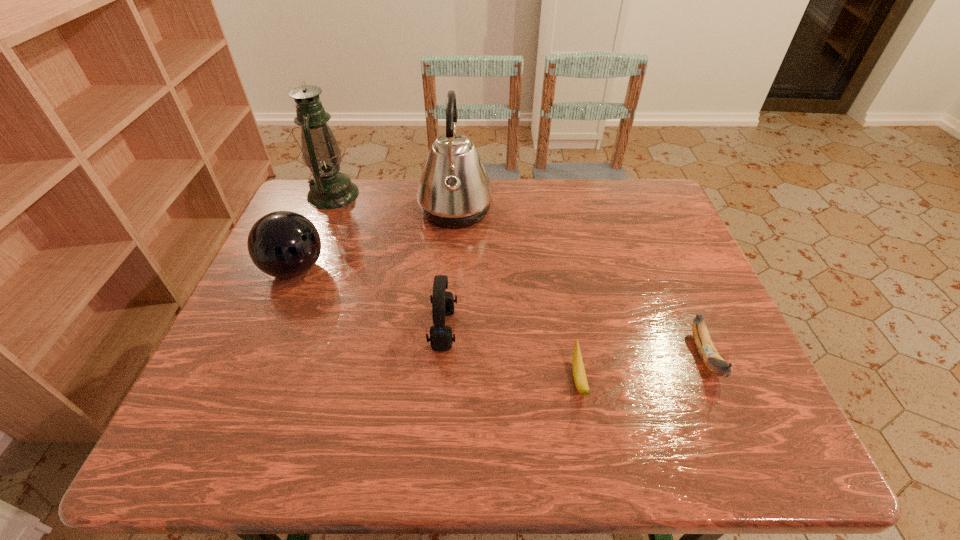
Find the location of a particular element. This screenshot has width=960, height=540. free space located on the side of the bowling ball with the finger holes is located at coordinates (x=416, y=269).

You are a GUI agent. You are given a task and a screenshot of the screen. Output one action in this format:
    pyautogui.click(x=<x>, y=<y>)
    Task: Click on the free space located on the headband of the third shortest object
    The width and height of the screenshot is (960, 540).
    Given the screenshot: What is the action you would take?
    pyautogui.click(x=483, y=329)

The image size is (960, 540). What are the coordinates of `free space located on the peel of the rightmost object` in the screenshot? It's located at (730, 413).

The image size is (960, 540). I want to click on vacant space located 0.060m at the stem of the shortest object, so [590, 442].

I want to click on kettle present at the far edge, so click(x=454, y=191).

What are the coordinates of `oil lamp at the far edge` in the screenshot? It's located at (329, 189).

At what (x,y) coordinates should I click in order to perform the action: click on oil lamp located in the left edge section of the desktop. Please return your answer as a coordinate pair (x, y). This screenshot has height=540, width=960. Looking at the image, I should click on (329, 189).

Locate an element on the screen. The height and width of the screenshot is (540, 960). bowling ball at the left edge is located at coordinates (283, 244).

Locate an element on the screen. object present at the right edge is located at coordinates (715, 363).

Locate an element on the screen. The height and width of the screenshot is (540, 960). object at the far left corner is located at coordinates (329, 189).